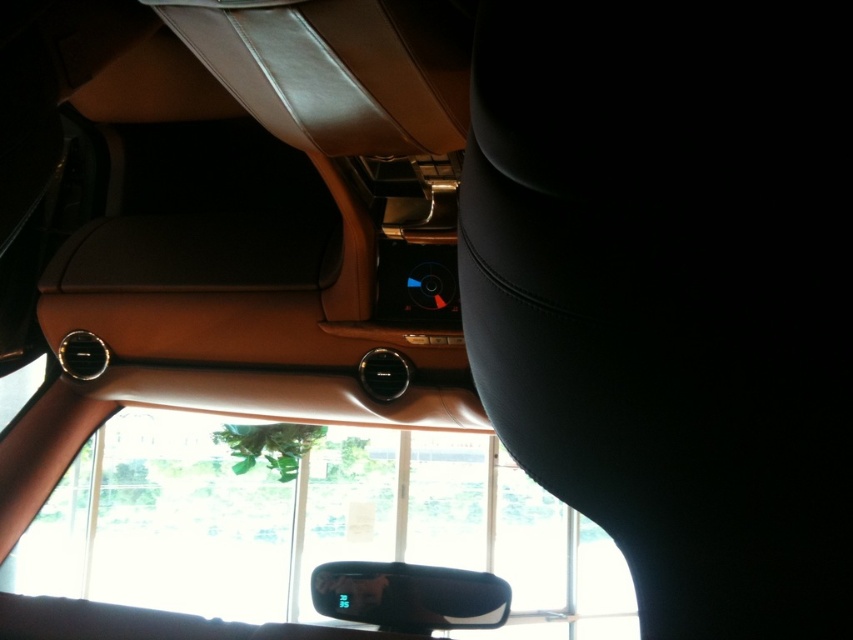
You are sitting in the driver seat of the car and want to adjust the black glossy rearview mirror at center. Which side of the black leather seat at center should you move the mirror towards to position it correctly?

The black leather seat at center is to the right of the black glossy rearview mirror at center, so you should move the mirror towards the left side of the black leather seat at center to position it correctly.

Consider the image. You are a passenger in the car and want to adjust the rearview mirror to get a better view of the road behind. Which object, the black leather seat at center or the black glossy rearview mirror at center, is in the way of adjusting the mirror?

The black leather seat at center is positioned over the black glossy rearview mirror at center, so the black leather seat at center is in the way of adjusting the mirror.